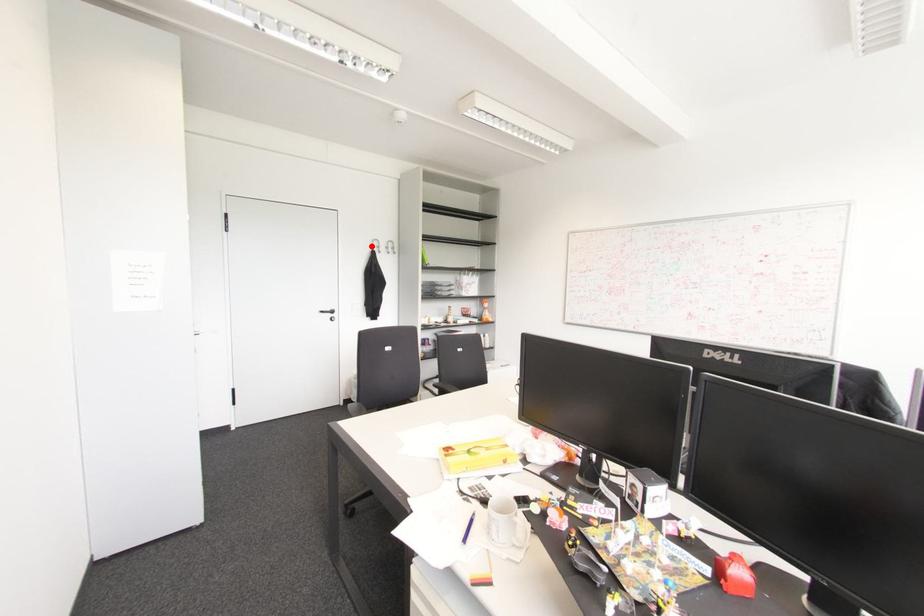
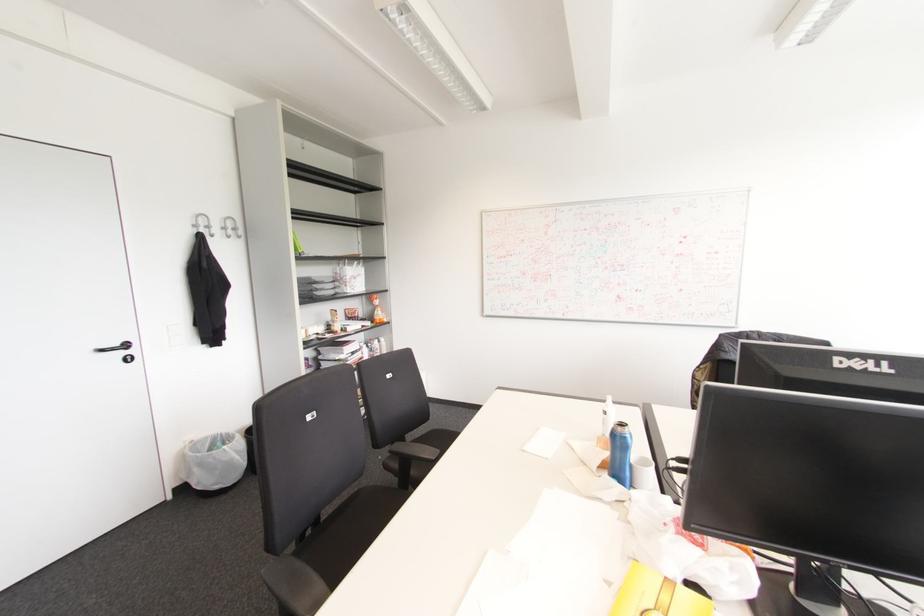
Locate, in the second image, the point that corresponds to the highlighted location in the first image.

(195, 225)